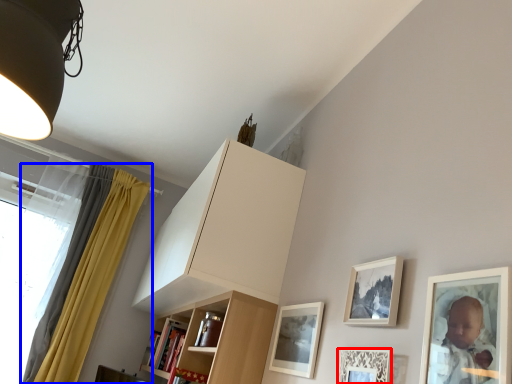
Question: Which of the following is the farthest to the observer, picture frame (highlighted by a red box) or curtain (highlighted by a blue box)?

Choices:
 (A) picture frame
 (B) curtain

Answer: (B)